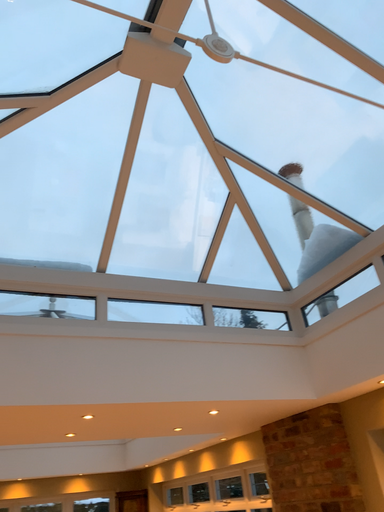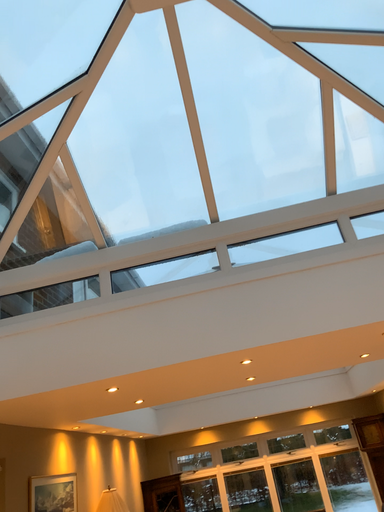
Question: Which way did the camera rotate in the video?

Choices:
 (A) rotated upward
 (B) rotated downward

Answer: (B)